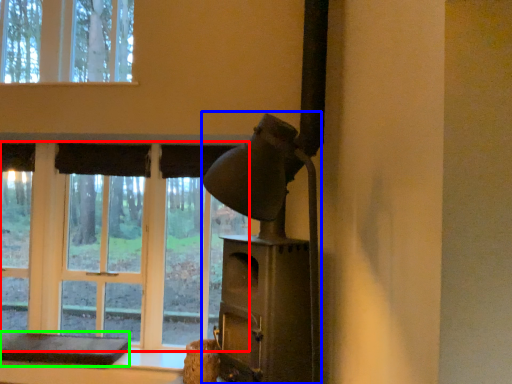
Question: Which object is positioned closest to bay window (highlighted by a red box)? Select from fireplace (highlighted by a blue box) and furniture (highlighted by a green box).

Choices:
 (A) fireplace
 (B) furniture

Answer: (B)